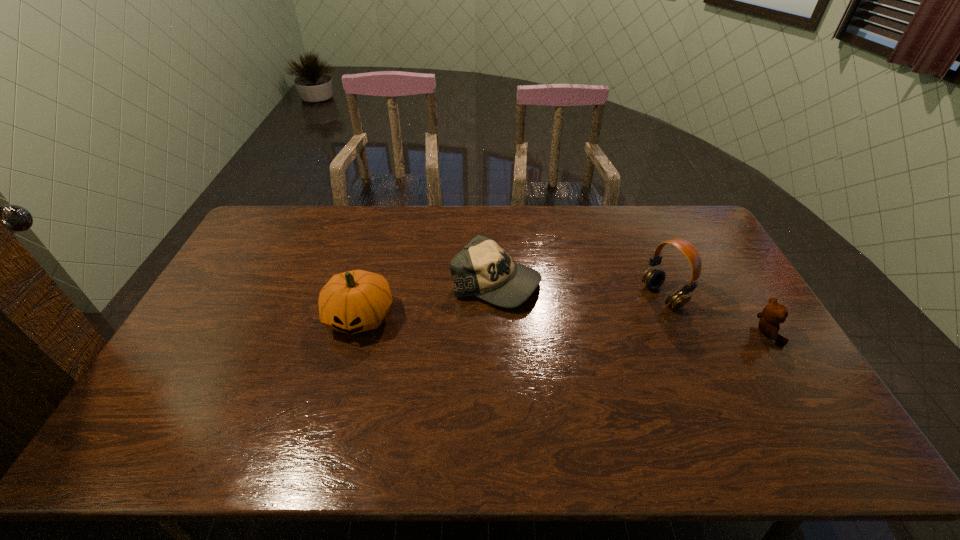
At what (x,y) coordinates should I click in order to perform the action: click on free spot on the desktop that is between the leftmost object and the rightmost object and is positioned on the ear cups of the third object from left to right. Please return your answer as a coordinate pair (x, y). Image resolution: width=960 pixels, height=540 pixels. Looking at the image, I should click on (593, 326).

The height and width of the screenshot is (540, 960). I want to click on vacant space on the desktop that is between the third shortest object and the rightmost object and is positioned on the front-facing side of the third object from right to left, so click(577, 325).